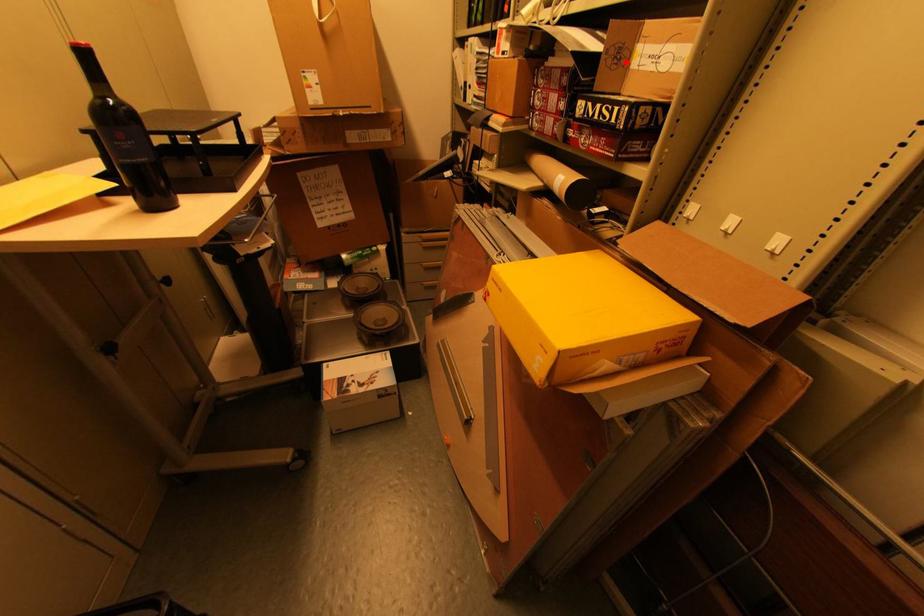
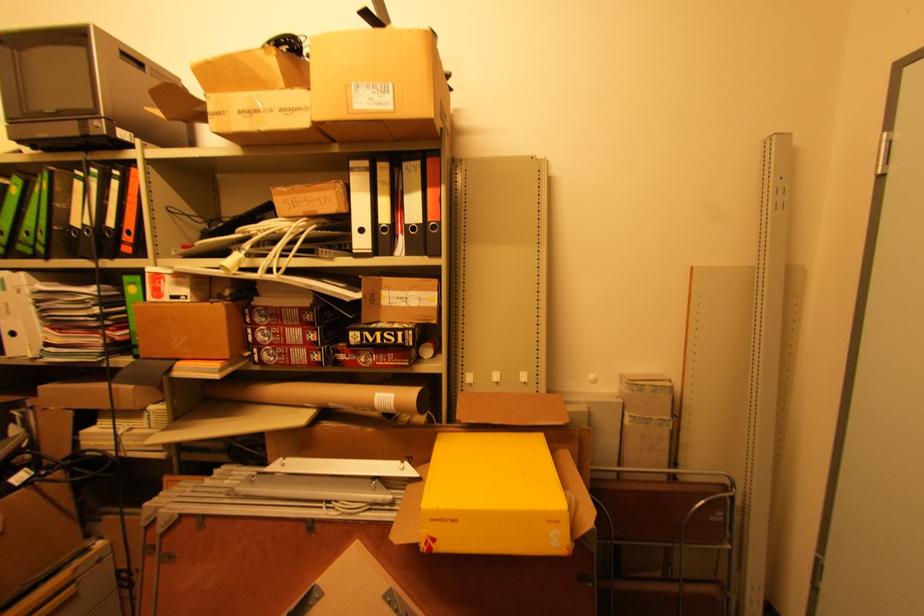
The point at the highlighted location is marked in the first image. Where is the corresponding point in the second image?

(380, 302)